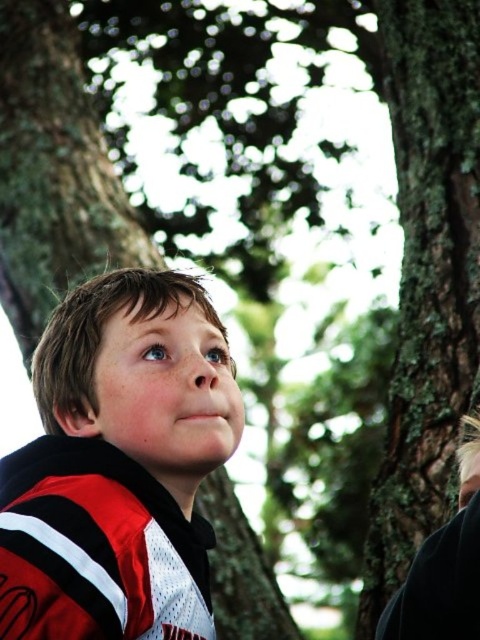
Question: Is red and white jersey at center above green mossy bark at right?

Choices:
 (A) no
 (B) yes

Answer: (A)

Question: In this image, where is red and white jersey at center located relative to green mossy bark at right?

Choices:
 (A) right
 (B) left

Answer: (B)

Question: Is red and white jersey at center above green mossy bark at right?

Choices:
 (A) no
 (B) yes

Answer: (A)

Question: Which object appears farthest from the camera in this image?

Choices:
 (A) green mossy bark at right
 (B) red and white jersey at center

Answer: (A)

Question: Which point appears closest to the camera in this image?

Choices:
 (A) (440, 444)
 (B) (83, 564)

Answer: (B)